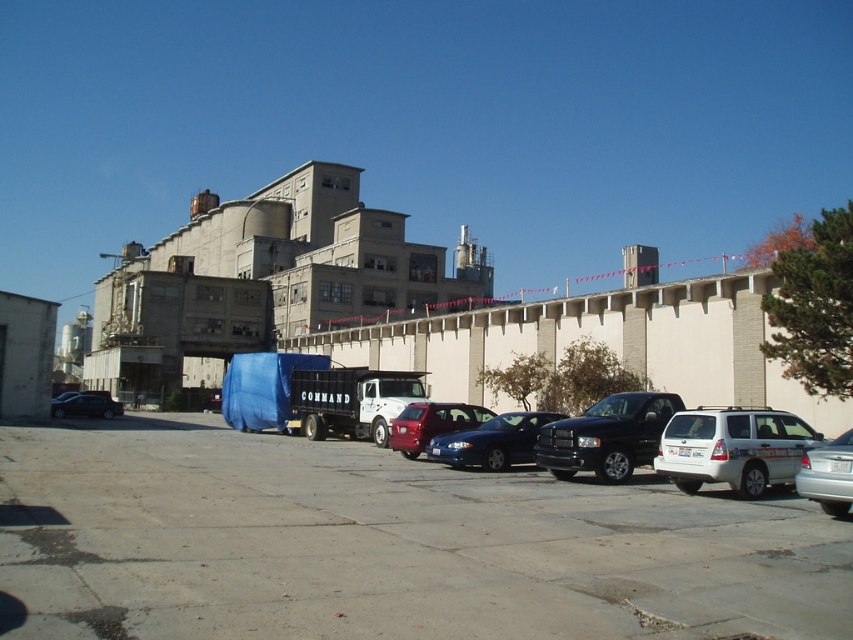
Between glossy blue sedan at center and shiny red sedan at center, which one is positioned lower?

glossy blue sedan at center is below.

Locate an element on the screen. The image size is (853, 640). glossy blue sedan at center is located at coordinates (492, 442).

At what (x,y) coordinates should I click in order to perform the action: click on glossy blue sedan at center. Please return your answer as a coordinate pair (x, y). This screenshot has width=853, height=640. Looking at the image, I should click on (492, 442).

Is point (693, 636) positioned in front of point (434, 413)?

Yes, point (693, 636) is closer to viewer.

Who is more distant from viewer, (485, 520) or (482, 417)?

The point (482, 417) is behind.

Describe the element at coordinates (383, 547) in the screenshot. This screenshot has width=853, height=640. I see `gray concrete parking lot at center` at that location.

You are a GUI agent. You are given a task and a screenshot of the screen. Output one action in this format:
    pyautogui.click(x=<x>, y=<y>)
    Task: Click on the gray concrete parking lot at center
    
    Given the screenshot: What is the action you would take?
    pyautogui.click(x=383, y=547)

Does gray concrete parking lot at center appear on the left side of glossy blue sedan at center?

Correct, you'll find gray concrete parking lot at center to the left of glossy blue sedan at center.

Which is more to the right, gray concrete parking lot at center or glossy blue sedan at center?

From the viewer's perspective, glossy blue sedan at center appears more on the right side.

Where is `gray concrete parking lot at center`? The width and height of the screenshot is (853, 640). gray concrete parking lot at center is located at coordinates (383, 547).